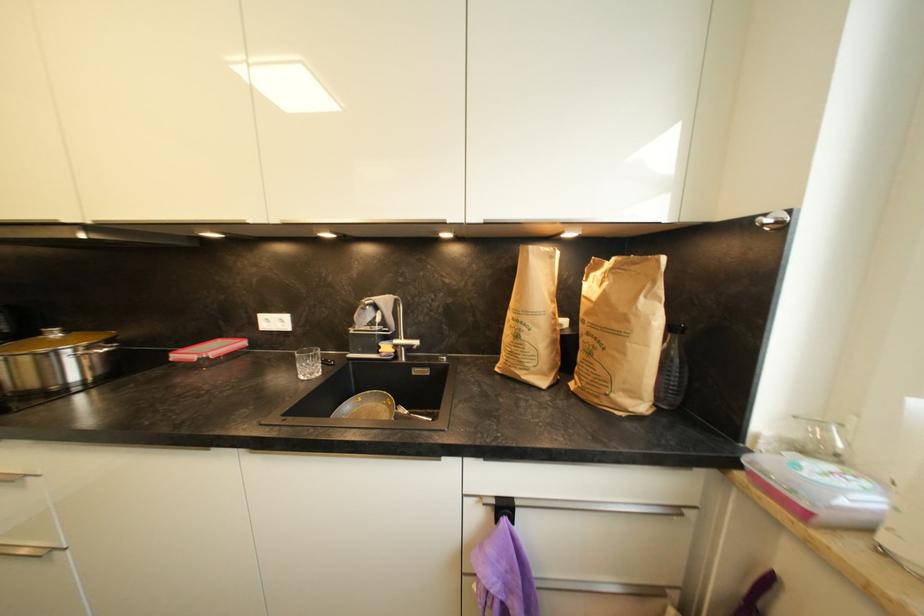
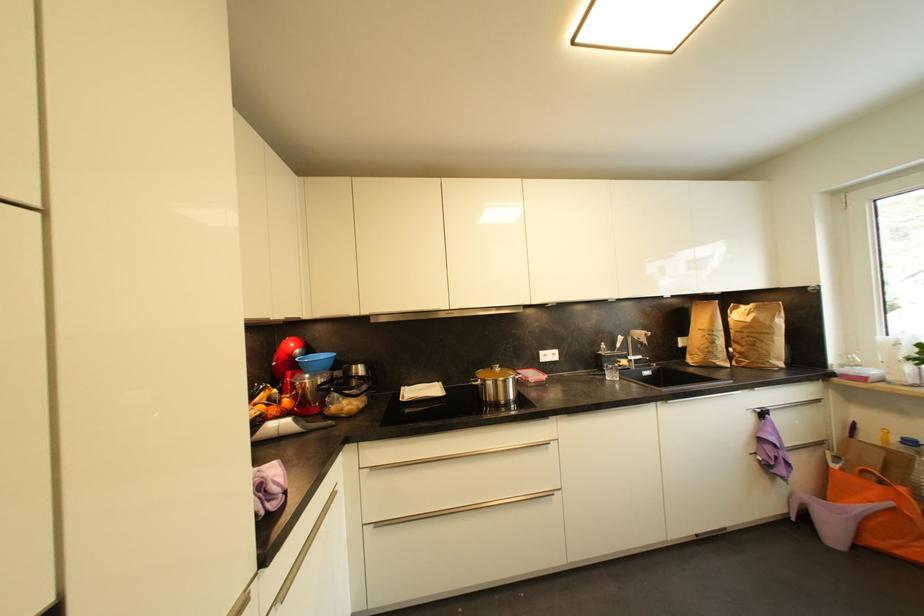
Locate, in the second image, the point that corresponds to [61,337] in the first image.

(503, 371)